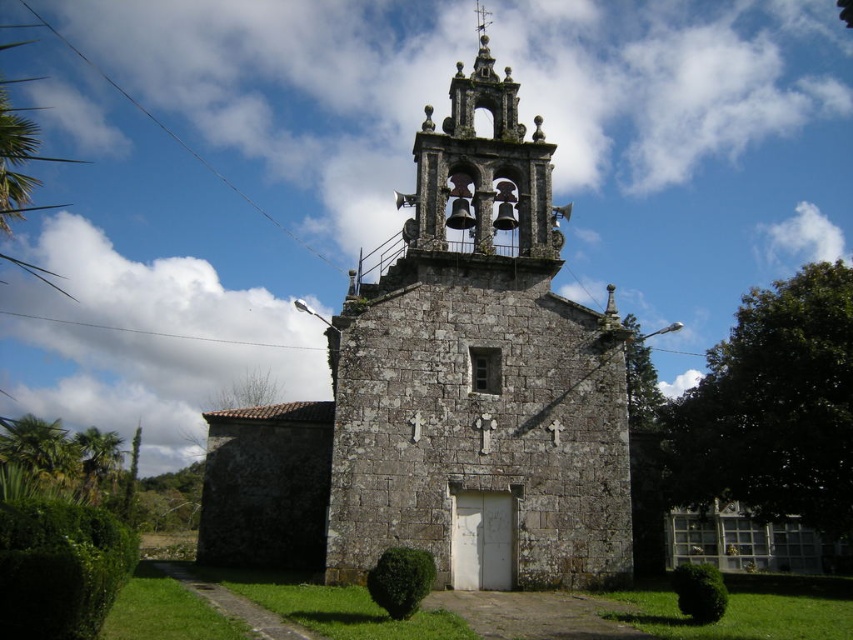
You are a visitor standing in front of the gray stone chapel at center and the stone bell tower at upper center. Which structure has a greater width?

The gray stone chapel at center has a greater width than the stone bell tower at upper center.

You are standing in front of the gray stone chapel at center and the stone bell tower at upper center. Which structure is located to the right side?

The stone bell tower at upper center is located to the right side of the gray stone chapel at center.

You are standing in front of the gray stone chapel at center and the stone bell tower at upper center. Which structure would require more materials to construct based on their sizes?

The gray stone chapel at center is bigger than the stone bell tower at upper center, so it would require more materials to construct.